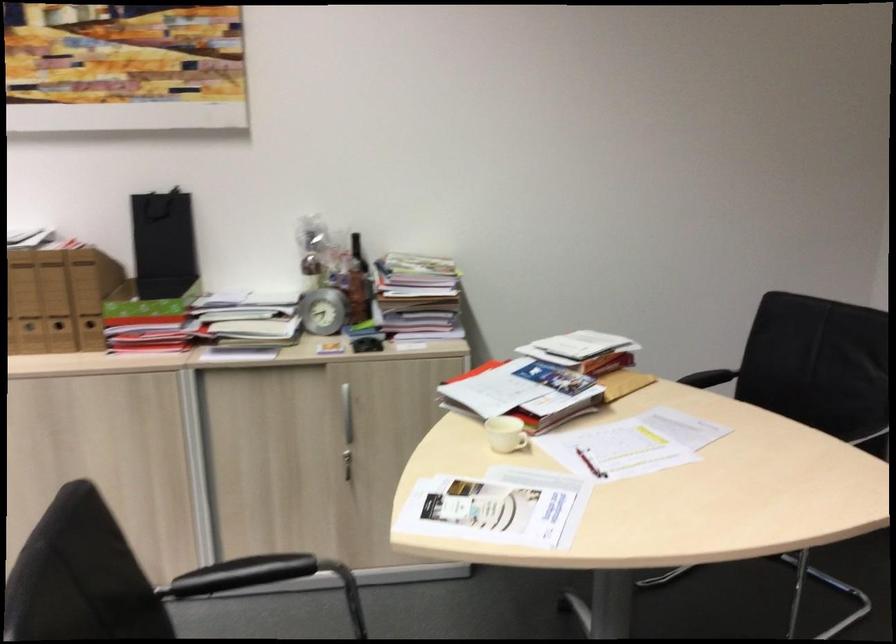
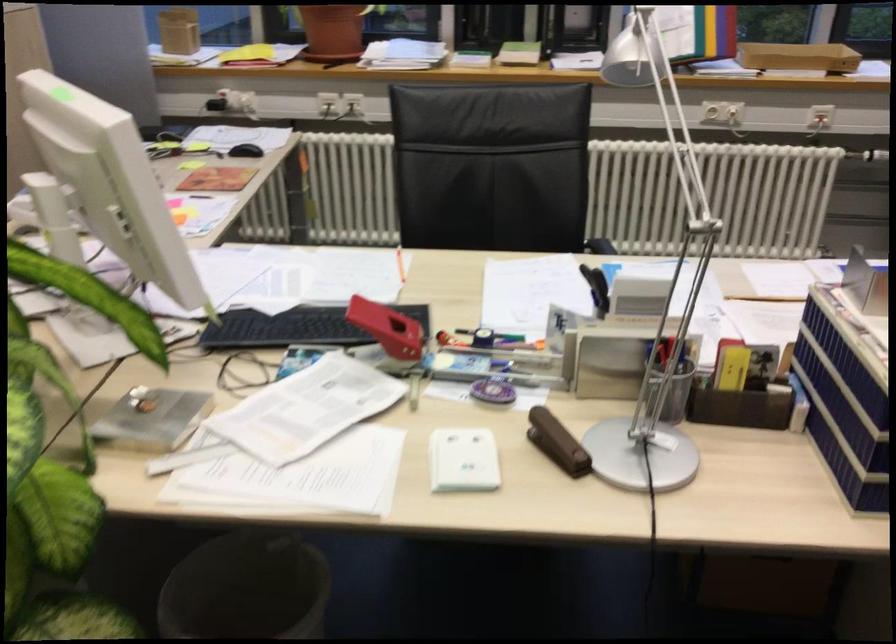
The images are taken continuously from a first-person perspective. In which direction is your viewpoint rotating?

The camera's rotation is toward left-down.